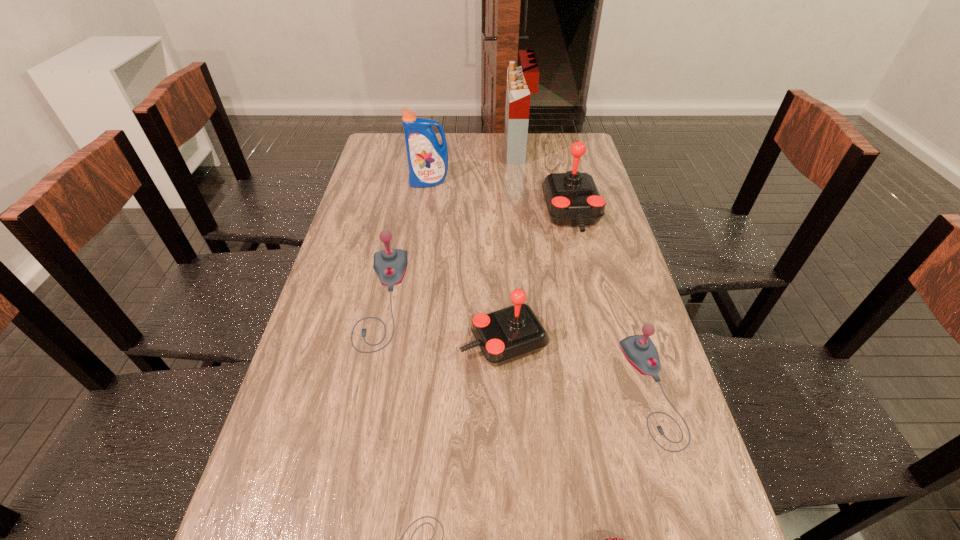
Locate which joystick is the fourth closest to the nearest joystick. Please provide its 2D coordinates. Your answer should be formatted as a tuple, i.e. [(x, y)], where the tuple contains the x and y coordinates of a point satisfying the conditions above.

[(572, 198)]

Locate an element on the screen. This screenshot has height=540, width=960. gray joystick that is the third closest one to the fourth tallest object is located at coordinates (x=424, y=516).

Locate an element on the screen. The width and height of the screenshot is (960, 540). the second closest gray joystick to the detergent is located at coordinates (639, 350).

At what (x,y) coordinates should I click in order to perform the action: click on vacant space that satisfies the following two spatial constraints: 1. with the lid open on the tallest object; 2. on the left side of the fourth tallest joystick. Please return your answer as a coordinate pair (x, y). This screenshot has height=540, width=960. Looking at the image, I should click on (545, 390).

At what (x,y) coordinates should I click in order to perform the action: click on vacant space that satisfies the following two spatial constraints: 1. on the label of the left red joystick; 2. on the right side of the detergent. Please return your answer as a coordinate pair (x, y). This screenshot has height=540, width=960. Looking at the image, I should click on (406, 342).

Identify the location of free space that satisfies the following two spatial constraints: 1. with the lid open on the cigarette case; 2. on the label of the detergent. (521, 182).

Find the location of a particular element. The height and width of the screenshot is (540, 960). free space that satisfies the following two spatial constraints: 1. on the label of the farthest joystick; 2. on the right side of the second tallest object is located at coordinates (424, 214).

You are a GUI agent. You are given a task and a screenshot of the screen. Output one action in this format:
    pyautogui.click(x=<x>, y=<y>)
    Task: Click on the vacant region that satisfies the following two spatial constraints: 1. with the lid open on the red cigarette case; 2. on the label of the seventh nearest object
    
    Given the screenshot: What is the action you would take?
    [521, 182]